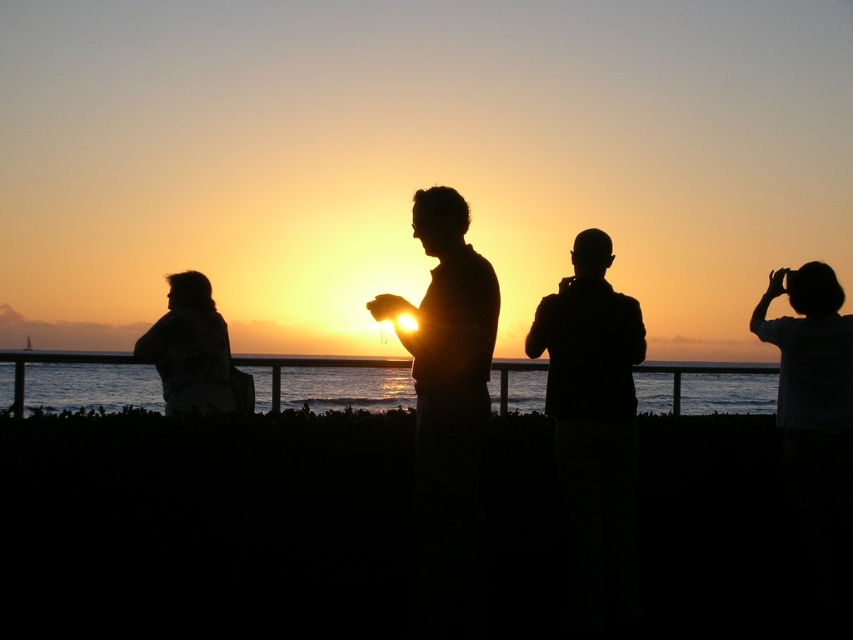
Question: Can you confirm if transparent water at center is positioned to the right of silhouette jacket at left?

Choices:
 (A) yes
 (B) no

Answer: (A)

Question: In this image, where is transparent water at center located relative to black matte person at center?

Choices:
 (A) right
 (B) left

Answer: (A)

Question: Which point is closer to the camera?

Choices:
 (A) transparent water at center
 (B) black matte person at center

Answer: (B)

Question: From the image, what is the correct spatial relationship of silhouette figure at center in relation to silhouette jacket at left?

Choices:
 (A) below
 (B) above

Answer: (B)

Question: Based on their relative distances, which object is nearer to the silhouette figure at center?

Choices:
 (A) white matte shirt at right
 (B) silhouette jacket at left
 (C) transparent water at center
 (D) black matte person at center

Answer: (D)

Question: Among these points, which one is nearest to the camera?

Choices:
 (A) (593, 413)
 (B) (817, 300)

Answer: (A)